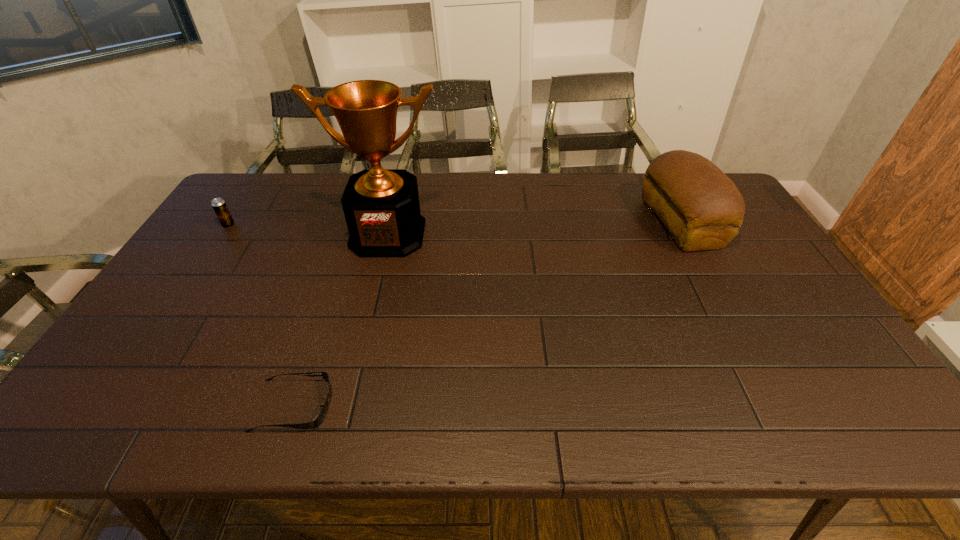
I want to click on vacant region located 0.070m on the front-facing side of the nearest object, so click(x=363, y=406).

Where is `object that is positioned at the far edge`? object that is positioned at the far edge is located at coordinates (701, 207).

Identify the location of object situated at the near edge. (320, 417).

This screenshot has width=960, height=540. In order to click on object present at the left edge in this screenshot , I will do `click(223, 214)`.

This screenshot has height=540, width=960. Find the location of `object present at the right edge`. object present at the right edge is located at coordinates (701, 207).

This screenshot has width=960, height=540. Identify the location of object that is at the far right corner. pos(701,207).

The width and height of the screenshot is (960, 540). What are the coordinates of `vacant area at the far edge` in the screenshot? It's located at (333, 206).

In the image, there is a desktop. Where is `blank space at the near edge`? blank space at the near edge is located at coordinates (276, 429).

The image size is (960, 540). I want to click on free location at the right edge of the desktop, so click(781, 284).

In order to click on free space between the second shortest object and the sunglasses in this screenshot , I will do [261, 315].